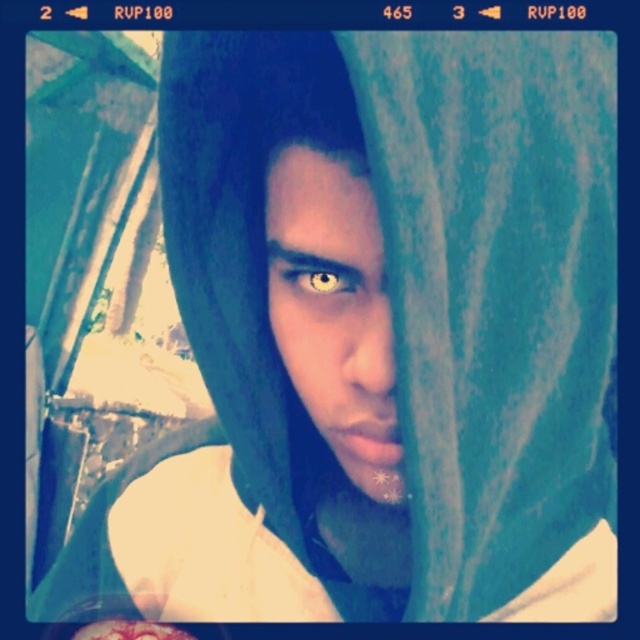
How much distance is there between matte skin face at center and yellow matte eye at center?

matte skin face at center is 1.11 inches from yellow matte eye at center.

Can you confirm if matte skin face at center is bigger than yellow matte eye at center?

Yes.

Is point (330, 209) in front of point (314, 282)?

Yes.

The width and height of the screenshot is (640, 640). Find the location of `matte skin face at center`. matte skin face at center is located at coordinates (333, 310).